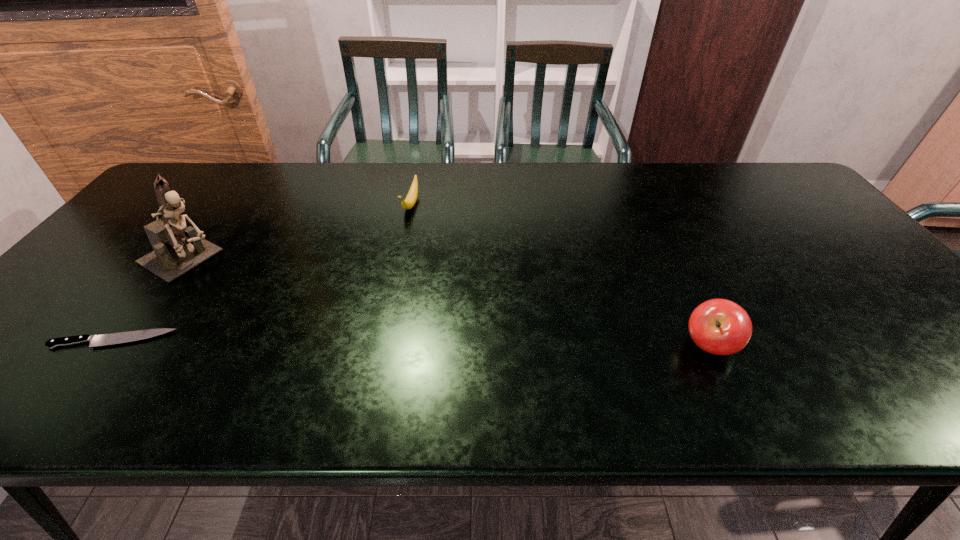
This screenshot has width=960, height=540. Identify the location of the shortest object. (114, 338).

Locate an element on the screen. The width and height of the screenshot is (960, 540). apple is located at coordinates (718, 326).

Locate an element on the screen. the rightmost object is located at coordinates (718, 326).

I want to click on the tallest object, so click(x=178, y=249).

What are the coordinates of `figurine` in the screenshot? It's located at coord(178,249).

Locate an element on the screen. Image resolution: width=960 pixels, height=540 pixels. the second shortest object is located at coordinates (409, 202).

What are the coordinates of `the farthest object` in the screenshot? It's located at (409, 202).

Identify the location of free space located 0.170m on the right of the shortest object. (249, 340).

The image size is (960, 540). Identify the location of free location located on the stem of the apple. pyautogui.click(x=614, y=346).

Identify the location of free space located on the stem of the apple. This screenshot has height=540, width=960. [x=651, y=346].